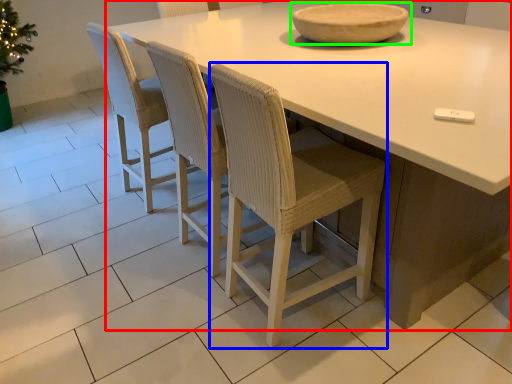
Question: Based on their relative distances, which object is farther from table (highlighted by a red box)? Choose from chair (highlighted by a blue box) and bowl (highlighted by a green box).

Choices:
 (A) chair
 (B) bowl

Answer: (B)